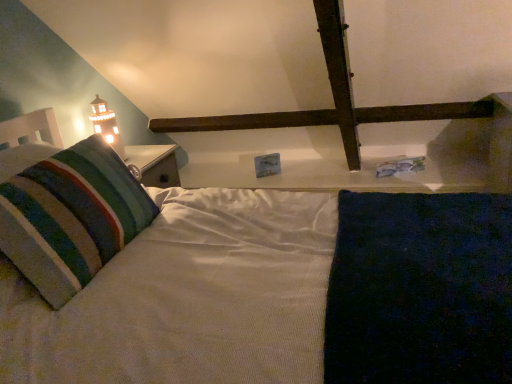
Where is `soft striped pillow at left`? This screenshot has width=512, height=384. soft striped pillow at left is located at coordinates (71, 217).

What do you see at coordinates (71, 217) in the screenshot?
I see `soft striped pillow at left` at bounding box center [71, 217].

Describe the element at coordinates (106, 125) in the screenshot. I see `matte white tower at upper left` at that location.

Measure the distance between matte white tower at upper left and camera.

The distance of matte white tower at upper left from camera is 2.07 meters.

Find the location of a particular element. matte white tower at upper left is located at coordinates (106, 125).

The height and width of the screenshot is (384, 512). I want to click on soft striped pillow at left, so click(x=71, y=217).

Is soft striped pillow at left to the left or to the right of matte white tower at upper left in the image?

From the image, it's evident that soft striped pillow at left is to the left of matte white tower at upper left.

Is soft striped pillow at left behind matte white tower at upper left?

That is False.

Is point (28, 270) positioned after point (99, 133)?

No, (28, 270) is closer to viewer.

From the image's perspective, which one is positioned lower, soft striped pillow at left or matte white tower at upper left?

soft striped pillow at left.

From a real-world perspective, which object rests below the other?

soft striped pillow at left.

Considering the sizes of soft striped pillow at left and matte white tower at upper left in the image, is soft striped pillow at left wider or thinner than matte white tower at upper left?

Clearly, soft striped pillow at left has more width compared to matte white tower at upper left.

Is soft striped pillow at left taller than matte white tower at upper left?

No.

Which of these two, soft striped pillow at left or matte white tower at upper left, is smaller?

matte white tower at upper left.

Would you say soft striped pillow at left is inside or outside matte white tower at upper left?

soft striped pillow at left is spatially situated outside matte white tower at upper left.

Are soft striped pillow at left and matte white tower at upper left beside each other?

No, soft striped pillow at left is not with matte white tower at upper left.

Is soft striped pillow at left turned away from matte white tower at upper left?

Yes, soft striped pillow at left is facing away from matte white tower at upper left.

What's the angular difference between soft striped pillow at left and matte white tower at upper left's facing directions?

They differ by 96.6 degrees in their facing directions.

At what (x,y) coordinates should I click in order to perform the action: click on pillow below the matte white tower at upper left (from a real-world perspective). Please return your answer as a coordinate pair (x, y). The image size is (512, 384). Looking at the image, I should click on (71, 217).

Does matte white tower at upper left appear on the right side of soft striped pillow at left?

Indeed, matte white tower at upper left is positioned on the right side of soft striped pillow at left.

Who is more distant, matte white tower at upper left or soft striped pillow at left?

matte white tower at upper left is further from the camera.

Is point (116, 141) closer to viewer compared to point (149, 212)?

No, it is behind (149, 212).

From the image's perspective, is matte white tower at upper left under soft striped pillow at left?

Actually, matte white tower at upper left appears above soft striped pillow at left in the image.

From a real-world perspective, is matte white tower at upper left positioned above or below soft striped pillow at left?

Clearly, from a real-world perspective, matte white tower at upper left is above soft striped pillow at left.

Considering the relative sizes of matte white tower at upper left and soft striped pillow at left in the image provided, is matte white tower at upper left thinner than soft striped pillow at left?

Yes.

Considering the relative sizes of matte white tower at upper left and soft striped pillow at left in the image provided, is matte white tower at upper left shorter than soft striped pillow at left?

In fact, matte white tower at upper left may be taller than soft striped pillow at left.

Considering the sizes of objects matte white tower at upper left and soft striped pillow at left in the image provided, who is bigger, matte white tower at upper left or soft striped pillow at left?

soft striped pillow at left.

Choose the correct answer: Is matte white tower at upper left inside soft striped pillow at left or outside it?

matte white tower at upper left is not inside soft striped pillow at left, it's outside.

Looking at this image, can you see matte white tower at upper left touching soft striped pillow at left?

No, matte white tower at upper left is not with soft striped pillow at left.

From the picture: Is matte white tower at upper left facing away from soft striped pillow at left?

No, soft striped pillow at left is not at the back of matte white tower at upper left.

How many degrees apart are the facing directions of matte white tower at upper left and soft striped pillow at left?

They differ by 96.6 degrees in their facing directions.

Locate an element on the screen. This screenshot has height=384, width=512. table lamp above the soft striped pillow at left (from a real-world perspective) is located at coordinates (106, 125).

You are a GUI agent. You are given a task and a screenshot of the screen. Output one action in this format:
    pyautogui.click(x=<x>, y=<y>)
    Task: Click on the pillow below the matte white tower at upper left (from a real-world perspective)
    The image size is (512, 384).
    Given the screenshot: What is the action you would take?
    pyautogui.click(x=71, y=217)

You are a GUI agent. You are given a task and a screenshot of the screen. Output one action in this format:
    pyautogui.click(x=<x>, y=<y>)
    Task: Click on the table lamp lying behind the soft striped pillow at left
    The width and height of the screenshot is (512, 384).
    Given the screenshot: What is the action you would take?
    pyautogui.click(x=106, y=125)